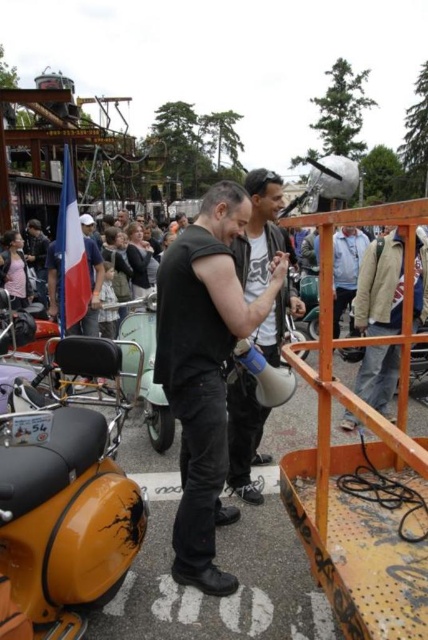
Question: Does yellow matte tank at lower left have a larger size compared to light gray jacket at center?

Choices:
 (A) no
 (B) yes

Answer: (A)

Question: Which of the following is the closest to the observer?

Choices:
 (A) light gray jacket at center
 (B) yellow matte tank at lower left

Answer: (B)

Question: Which of these objects is positioned farthest from the black matte vest at center?

Choices:
 (A) light gray jacket at center
 (B) matte black megaphone at center
 (C) yellow matte tank at lower left

Answer: (A)

Question: Can you confirm if yellow matte tank at lower left is positioned to the right of black matte vest at center?

Choices:
 (A) yes
 (B) no

Answer: (B)

Question: Is black matte vest at center to the right of light gray jacket at center from the viewer's perspective?

Choices:
 (A) yes
 (B) no

Answer: (B)

Question: Which of these objects is positioned closest to the light gray jacket at center?

Choices:
 (A) black matte vest at center
 (B) yellow matte tank at lower left

Answer: (A)